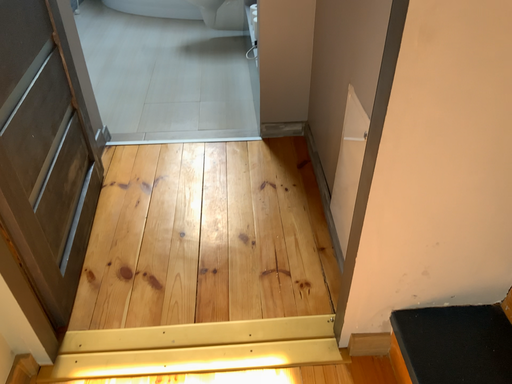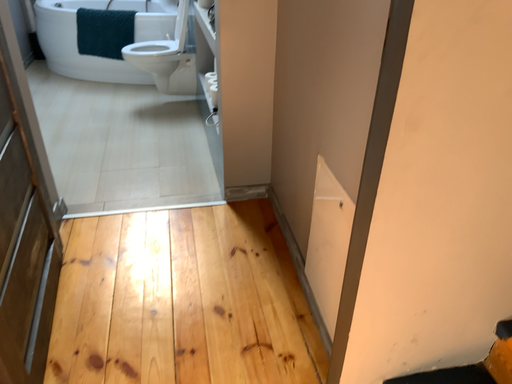
Question: Which way did the camera rotate in the video?

Choices:
 (A) rotated upward
 (B) rotated downward

Answer: (A)